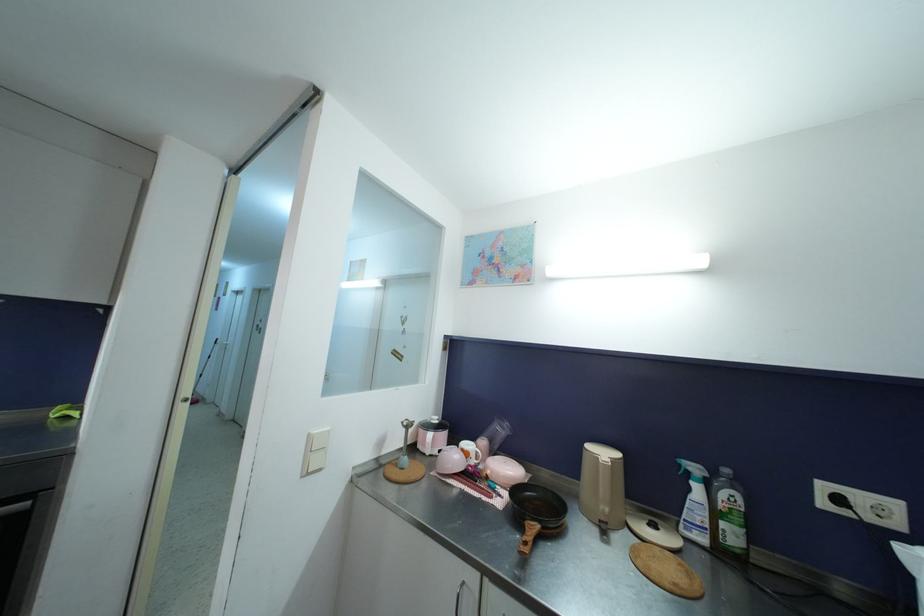
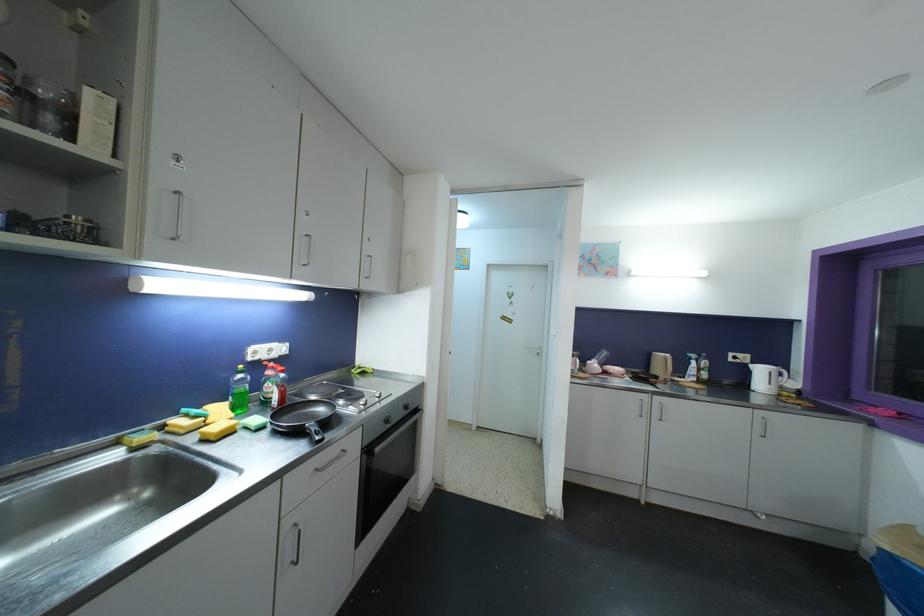
Find the pixel in the second image that matches (827,488) in the first image.

(734, 357)